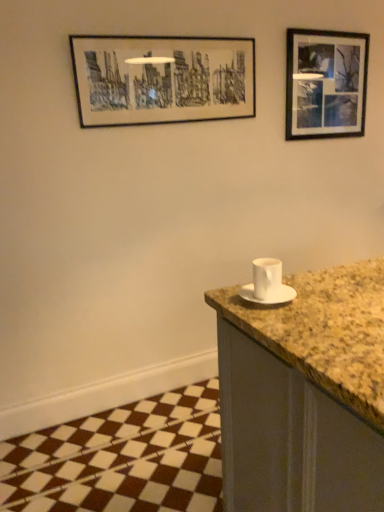
This screenshot has height=512, width=384. I want to click on black matte picture frame at upper right, marked as the first picture frame in a right-to-left arrangement, so click(x=325, y=84).

The width and height of the screenshot is (384, 512). I want to click on white ceramic cup at right, so click(267, 284).

Is white ceramic cup at right far away from black matte picture frame at upper center, which is the 1th picture frame from front to back?

Absolutely, white ceramic cup at right is distant from black matte picture frame at upper center, which is the 1th picture frame from front to back.

Considering the sizes of objects white ceramic cup at right and black matte picture frame at upper center, which is the first picture frame in left-to-right order, in the image provided, who is smaller, white ceramic cup at right or black matte picture frame at upper center, which is the first picture frame in left-to-right order,?

white ceramic cup at right is smaller.

Is white ceramic cup at right looking in the opposite direction of black matte picture frame at upper right, the 2th picture frame positioned from the left?

That's not correct — white ceramic cup at right is not looking away from black matte picture frame at upper right, the 2th picture frame positioned from the left.

From a real-world perspective, is white ceramic cup at right positioned under black matte picture frame at upper right, the 2th picture frame positioned from the left, based on gravity?

Yes, from a real-world perspective, white ceramic cup at right is beneath black matte picture frame at upper right, the 2th picture frame positioned from the left.

From the image's perspective, is white ceramic cup at right below black matte picture frame at upper right, the 2th picture frame positioned from the left?

Yes, from the image's perspective, white ceramic cup at right is beneath black matte picture frame at upper right, the 2th picture frame positioned from the left.

Is point (274, 282) closer or farther from the camera than point (347, 68)?

Point (274, 282) is closer to the camera than point (347, 68).

From the image's perspective, which one is positioned lower, black matte picture frame at upper center, which is the first picture frame in left-to-right order, or black matte picture frame at upper right, arranged as the 2th picture frame when viewed from the front?

black matte picture frame at upper center, which is the first picture frame in left-to-right order, is shown below in the image.

Is black matte picture frame at upper center, acting as the 2th picture frame starting from the back, looking in the opposite direction of black matte picture frame at upper right, marked as the first picture frame in a right-to-left arrangement?

No, black matte picture frame at upper center, acting as the 2th picture frame starting from the back, is not facing away from black matte picture frame at upper right, marked as the first picture frame in a right-to-left arrangement.

Is black matte picture frame at upper center, marked as the 2th picture frame in a right-to-left arrangement, positioned far away from black matte picture frame at upper right, arranged as the 2th picture frame when viewed from the front?

black matte picture frame at upper center, marked as the 2th picture frame in a right-to-left arrangement, is actually quite close to black matte picture frame at upper right, arranged as the 2th picture frame when viewed from the front.

Between point (114, 76) and point (355, 67), which one is positioned behind?

The point (355, 67) is more distant.

Is white matte saucer at right surrounded by white ceramic cup at right?

Actually, white matte saucer at right is outside white ceramic cup at right.

From the image's perspective, is white ceramic cup at right above or below white matte saucer at right?

Based on their image positions, white ceramic cup at right is located above white matte saucer at right.

How distant is white ceramic cup at right from white matte saucer at right?

0.52 inches.

This screenshot has height=512, width=384. Find the location of `saucer behind the white ceramic cup at right`. saucer behind the white ceramic cup at right is located at coordinates (269, 295).

The height and width of the screenshot is (512, 384). What are the coordinates of `picture frame on the left side of black matte picture frame at upper right, arranged as the 2th picture frame when viewed from the front` in the screenshot? It's located at (162, 79).

Considering the positions of objects black matte picture frame at upper right, the 2th picture frame positioned from the left, and black matte picture frame at upper center, which is the 1th picture frame from front to back, in the image provided, who is more to the right, black matte picture frame at upper right, the 2th picture frame positioned from the left, or black matte picture frame at upper center, which is the 1th picture frame from front to back,?

Positioned to the right is black matte picture frame at upper right, the 2th picture frame positioned from the left.

From the image's perspective, which one is positioned higher, black matte picture frame at upper right, the first picture frame viewed from the back, or black matte picture frame at upper center, marked as the 2th picture frame in a right-to-left arrangement?

From the image's view, black matte picture frame at upper right, the first picture frame viewed from the back, is above.

Is white matte saucer at right not near white ceramic cup at right?

white matte saucer at right is actually quite close to white ceramic cup at right.

In terms of size, does white matte saucer at right appear bigger or smaller than white ceramic cup at right?

white matte saucer at right is smaller than white ceramic cup at right.

Would you say white ceramic cup at right is part of white matte saucer at right's contents?

No, white ceramic cup at right is not a part of white matte saucer at right.

From the image's perspective, is white matte saucer at right located beneath white ceramic cup at right?

Correct, white matte saucer at right appears lower than white ceramic cup at right in the image.

Can we say white matte saucer at right lies outside black matte picture frame at upper right, the first picture frame viewed from the back?

white matte saucer at right is positioned outside black matte picture frame at upper right, the first picture frame viewed from the back.

Which object is positioned more to the left, white matte saucer at right or black matte picture frame at upper right, the first picture frame viewed from the back?

From the viewer's perspective, white matte saucer at right appears more on the left side.

In terms of height, does white matte saucer at right look taller or shorter compared to black matte picture frame at upper right, arranged as the 2th picture frame when viewed from the front?

Clearly, white matte saucer at right is shorter compared to black matte picture frame at upper right, arranged as the 2th picture frame when viewed from the front.

This screenshot has height=512, width=384. Find the location of `picture frame that is the 2nd one above the white ceramic cup at right (from a real-world perspective)`. picture frame that is the 2nd one above the white ceramic cup at right (from a real-world perspective) is located at coordinates (162, 79).

Locate an element on the screen. The image size is (384, 512). sink below the black matte picture frame at upper right, marked as the first picture frame in a right-to-left arrangement (from a real-world perspective) is located at coordinates (267, 284).

Based on their spatial positions, is white ceramic cup at right or black matte picture frame at upper right, marked as the first picture frame in a right-to-left arrangement, closer to white matte saucer at right?

Among the two, white ceramic cup at right is located nearer to white matte saucer at right.

Which object lies nearer to the anchor point black matte picture frame at upper center, which is the 1th picture frame from front to back, black matte picture frame at upper right, the 2th picture frame positioned from the left, or white matte saucer at right?

black matte picture frame at upper right, the 2th picture frame positioned from the left.

Based on their spatial positions, is white ceramic cup at right or white matte saucer at right further from black matte picture frame at upper right, the 2th picture frame positioned from the left?

The object further to black matte picture frame at upper right, the 2th picture frame positioned from the left, is white matte saucer at right.

Based on their spatial positions, is black matte picture frame at upper center, marked as the 2th picture frame in a right-to-left arrangement, or black matte picture frame at upper right, the first picture frame viewed from the back, further from white matte saucer at right?

The object further to white matte saucer at right is black matte picture frame at upper right, the first picture frame viewed from the back.

When comparing their distances from black matte picture frame at upper right, the 2th picture frame positioned from the left, does white ceramic cup at right or black matte picture frame at upper center, marked as the 2th picture frame in a right-to-left arrangement, seem further?

white ceramic cup at right is further to black matte picture frame at upper right, the 2th picture frame positioned from the left.

From the image, which object appears to be farther from white matte saucer at right, white ceramic cup at right or black matte picture frame at upper center, marked as the 2th picture frame in a right-to-left arrangement?

Among the two, black matte picture frame at upper center, marked as the 2th picture frame in a right-to-left arrangement, is located further to white matte saucer at right.

Looking at the image, which one is located further to black matte picture frame at upper center, acting as the 2th picture frame starting from the back, white ceramic cup at right or black matte picture frame at upper right, arranged as the 2th picture frame when viewed from the front?

→ white ceramic cup at right.

Based on the photo, looking at the image, which one is located closer to white ceramic cup at right, black matte picture frame at upper center, acting as the 2th picture frame starting from the back, or white matte saucer at right?

The object closer to white ceramic cup at right is white matte saucer at right.

This screenshot has width=384, height=512. I want to click on sink between black matte picture frame at upper center, which is the 1th picture frame from front to back, and white matte saucer at right in the up-down direction, so click(x=267, y=284).

Identify the location of picture frame between white ceramic cup at right and black matte picture frame at upper right, the first picture frame viewed from the back, in the front-back direction. The width and height of the screenshot is (384, 512). (162, 79).

Identify the location of saucer between white ceramic cup at right and black matte picture frame at upper right, the first picture frame viewed from the back, from front to back. (269, 295).

Find the location of a particular element. The height and width of the screenshot is (512, 384). picture frame between black matte picture frame at upper right, marked as the first picture frame in a right-to-left arrangement, and white matte saucer at right vertically is located at coordinates (162, 79).